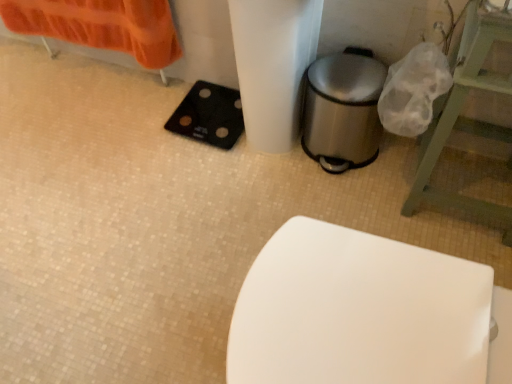
Question: From a real-world perspective, does green wooden stool at right sit lower than black rubber scale at lower left?

Choices:
 (A) yes
 (B) no

Answer: (B)

Question: Does green wooden stool at right have a lesser width compared to black rubber scale at lower left?

Choices:
 (A) no
 (B) yes

Answer: (A)

Question: Does green wooden stool at right appear on the left side of black rubber scale at lower left?

Choices:
 (A) no
 (B) yes

Answer: (A)

Question: Would you say black rubber scale at lower left is part of green wooden stool at right's contents?

Choices:
 (A) no
 (B) yes

Answer: (A)

Question: Is green wooden stool at right oriented away from black rubber scale at lower left?

Choices:
 (A) yes
 (B) no

Answer: (B)

Question: From the image's perspective, is polished stainless steel trash can at lower right positioned above or below black rubber scale at lower left?

Choices:
 (A) below
 (B) above

Answer: (A)

Question: Does point (369, 145) appear closer or farther from the camera than point (226, 120)?

Choices:
 (A) closer
 (B) farther

Answer: (A)

Question: Considering the positions of polished stainless steel trash can at lower right and black rubber scale at lower left in the image, is polished stainless steel trash can at lower right taller or shorter than black rubber scale at lower left?

Choices:
 (A) short
 (B) tall

Answer: (B)

Question: Considering the positions of polished stainless steel trash can at lower right and black rubber scale at lower left in the image, is polished stainless steel trash can at lower right wider or thinner than black rubber scale at lower left?

Choices:
 (A) wide
 (B) thin

Answer: (B)

Question: Considering the positions of green wooden stool at right and polished stainless steel trash can at lower right in the image, is green wooden stool at right taller or shorter than polished stainless steel trash can at lower right?

Choices:
 (A) tall
 (B) short

Answer: (A)

Question: Considering the relative positions of green wooden stool at right and polished stainless steel trash can at lower right in the image provided, is green wooden stool at right to the left or to the right of polished stainless steel trash can at lower right?

Choices:
 (A) right
 (B) left

Answer: (A)

Question: Looking at their shapes, would you say green wooden stool at right is wider or thinner than polished stainless steel trash can at lower right?

Choices:
 (A) thin
 (B) wide

Answer: (B)

Question: Does point (492, 135) appear closer or farther from the camera than point (369, 145)?

Choices:
 (A) farther
 (B) closer

Answer: (B)

Question: Choose the correct answer: Is black rubber scale at lower left inside green wooden stool at right or outside it?

Choices:
 (A) outside
 (B) inside

Answer: (A)

Question: Considering the positions of black rubber scale at lower left and green wooden stool at right in the image, is black rubber scale at lower left wider or thinner than green wooden stool at right?

Choices:
 (A) thin
 (B) wide

Answer: (A)